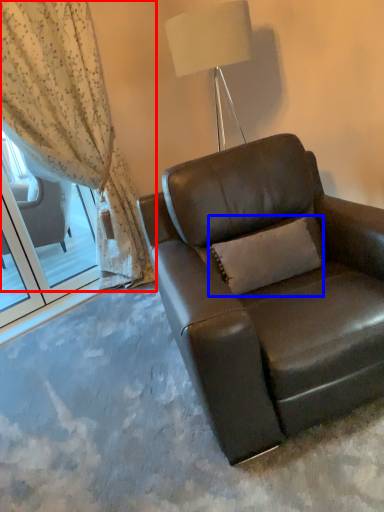
Question: Among these objects, which one is nearest to the camera, curtain (highlighted by a red box) or pillow (highlighted by a blue box)?

Choices:
 (A) curtain
 (B) pillow

Answer: (B)